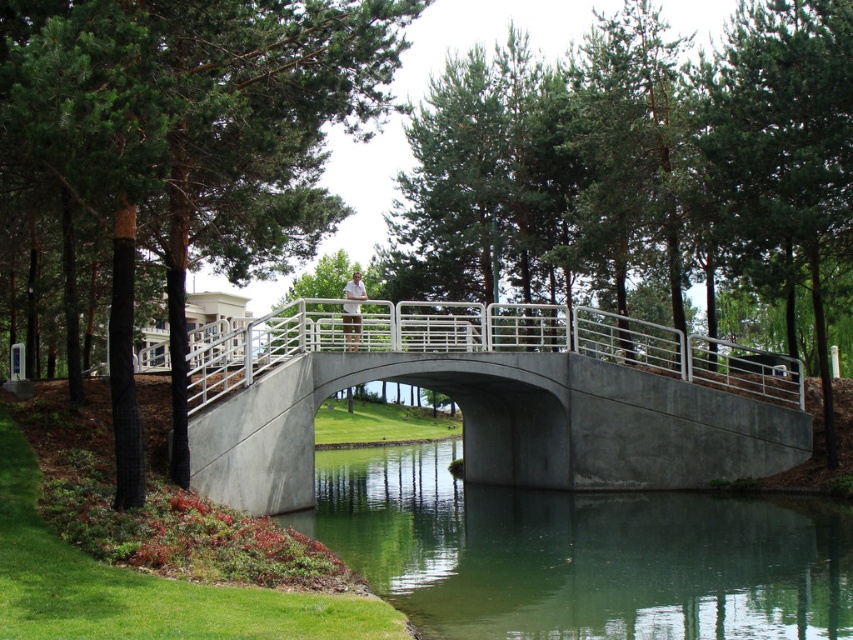
Who is higher up, concrete bridge at center or green smooth water at center?

Positioned higher is concrete bridge at center.

Does concrete bridge at center appear on the left side of green smooth water at center?

Correct, you'll find concrete bridge at center to the left of green smooth water at center.

Consider the image. Measure the distance between point (x=515, y=445) and camera.

A distance of 27.79 meters exists between point (x=515, y=445) and camera.

This screenshot has width=853, height=640. I want to click on concrete bridge at center, so click(x=494, y=397).

Is point (331, 42) positioned before point (497, 390)?

Yes, it is.

You are a GUI agent. You are given a task and a screenshot of the screen. Output one action in this format:
    pyautogui.click(x=<x>, y=<y>)
    Task: Click on the green leafy tree at upper center
    
    Given the screenshot: What is the action you would take?
    pyautogui.click(x=190, y=141)

Which of these two, green leafy tree at upper center or green smooth water at center, stands shorter?

Standing shorter between the two is green smooth water at center.

Is point (22, 120) positioned behind point (561, 577)?

No, (22, 120) is in front of (561, 577).

In order to click on green leafy tree at upper center in this screenshot , I will do `click(190, 141)`.